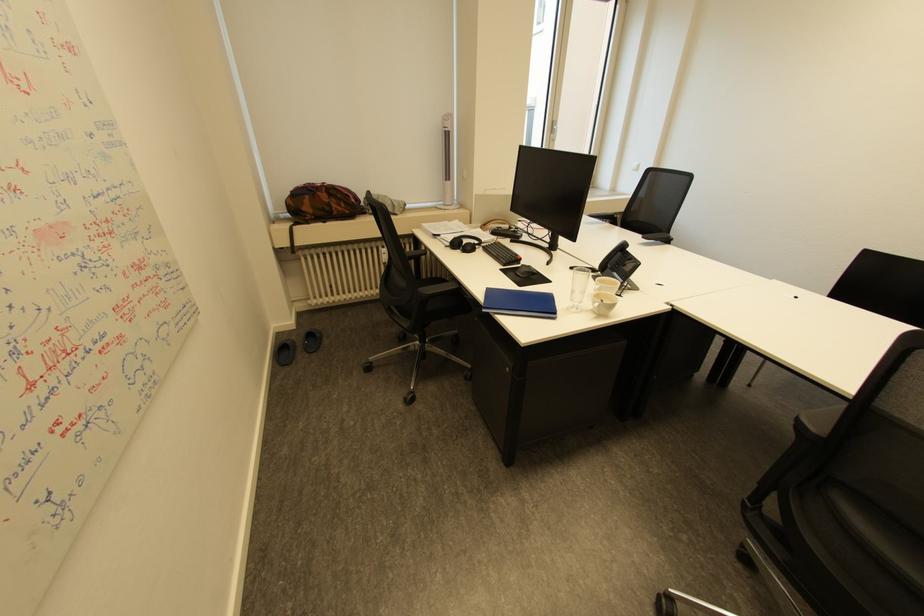
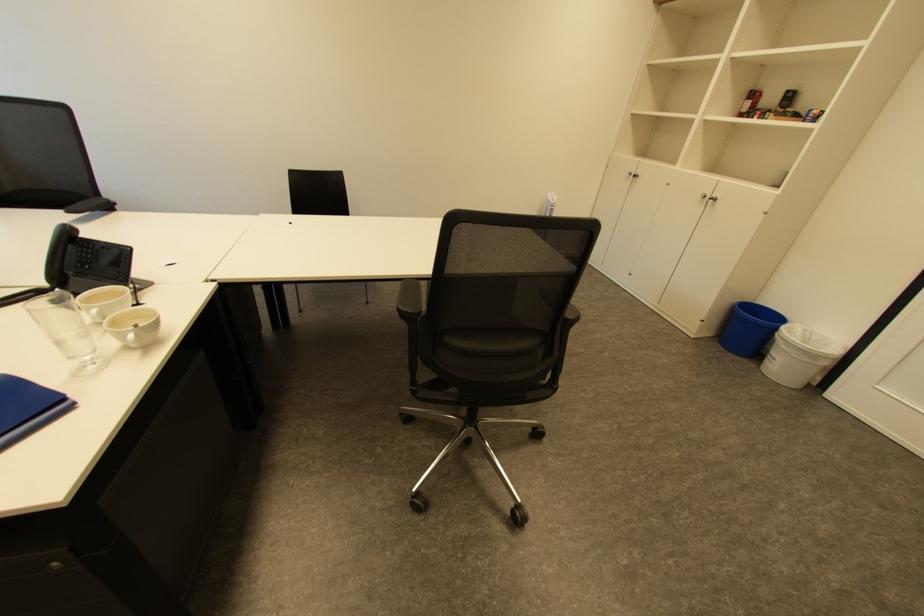
How did the camera likely rotate?

The rotation direction of the camera is right-down.